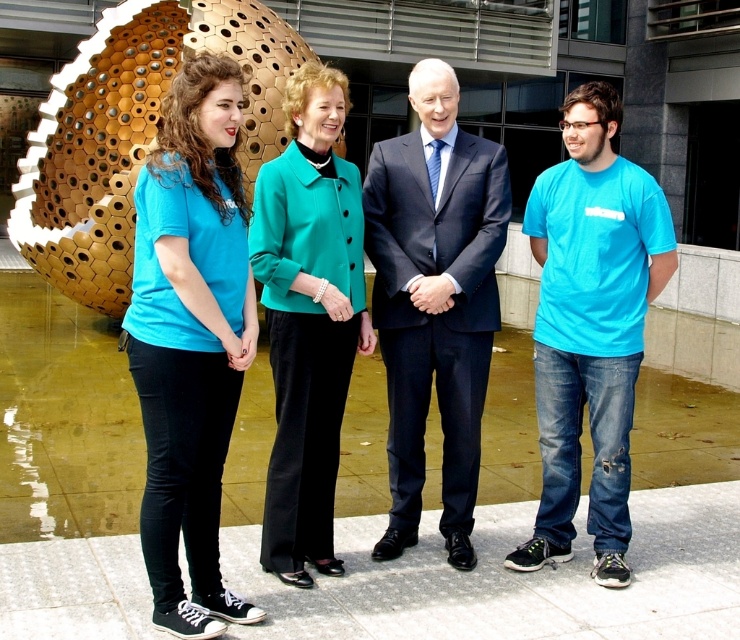
Looking at this image, does turquoise t-shirt at right lie in front of teal fabric jacket at center?

No, turquoise t-shirt at right is behind teal fabric jacket at center.

Can you confirm if turquoise t-shirt at right is wider than teal fabric jacket at center?

Yes.

Where is `turquoise t-shirt at right`? This screenshot has height=640, width=740. turquoise t-shirt at right is located at coordinates (591, 326).

Which is more to the left, matte blue shirt at left or turquoise t-shirt at right?

matte blue shirt at left is more to the left.

Is point (201, 204) less distant than point (531, 541)?

That is True.

This screenshot has width=740, height=640. In order to click on matte blue shirt at left in this screenshot , I will do `click(189, 337)`.

Is dark blue suit at center to the right of turquoise t-shirt at right from the viewer's perspective?

In fact, dark blue suit at center is to the left of turquoise t-shirt at right.

Looking at this image, between dark blue suit at center and turquoise t-shirt at right, which one appears on the left side from the viewer's perspective?

dark blue suit at center

Is point (414, 269) more distant than point (528, 564)?

Yes.

Locate an element on the screen. This screenshot has height=640, width=740. dark blue suit at center is located at coordinates click(434, 300).